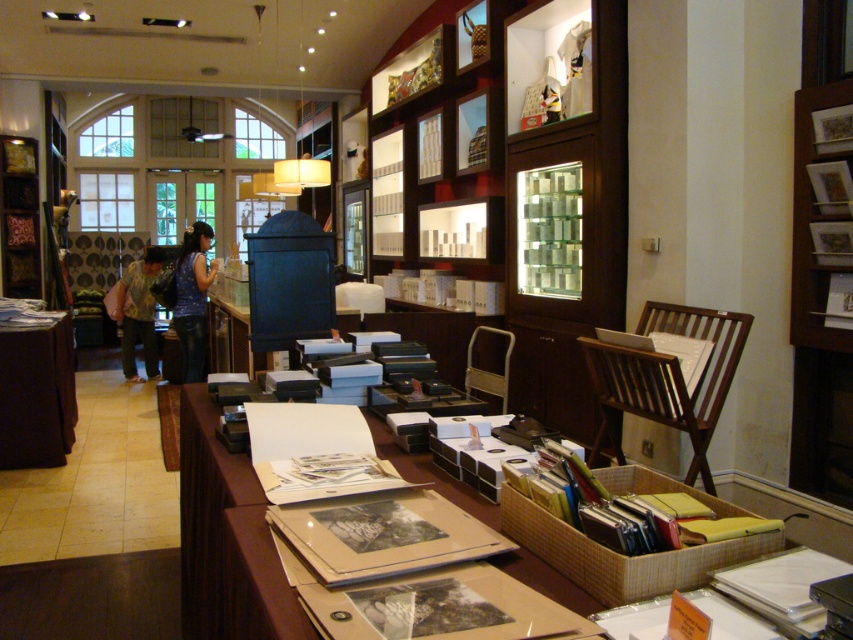
Question: Considering the relative positions of wooden bookshelf at upper right and yellow floral blouse at center in the image provided, where is wooden bookshelf at upper right located with respect to yellow floral blouse at center?

Choices:
 (A) right
 (B) left

Answer: (A)

Question: Does wooden bookshelf at upper right appear on the right side of yellow floral blouse at center?

Choices:
 (A) no
 (B) yes

Answer: (B)

Question: Estimate the real-world distances between objects in this image. Which object is farther from the brown fabric table at lower left?

Choices:
 (A) brown cardboard table at center
 (B) blue denim jeans at center
 (C) wooden bookshelf at left

Answer: (C)

Question: Which of the following is the closest to the observer?

Choices:
 (A) wooden bookshelf at upper right
 (B) brown fabric table at lower left
 (C) blue denim jeans at center
 (D) brown cardboard table at center

Answer: (D)

Question: Is wooden bookshelf at upper right closer to the viewer compared to wooden bookshelf at left?

Choices:
 (A) yes
 (B) no

Answer: (A)

Question: Among these objects, which one is nearest to the camera?

Choices:
 (A) wooden bookshelf at upper right
 (B) yellow floral blouse at center
 (C) wooden bookshelf at left
 (D) brown fabric table at lower left

Answer: (A)